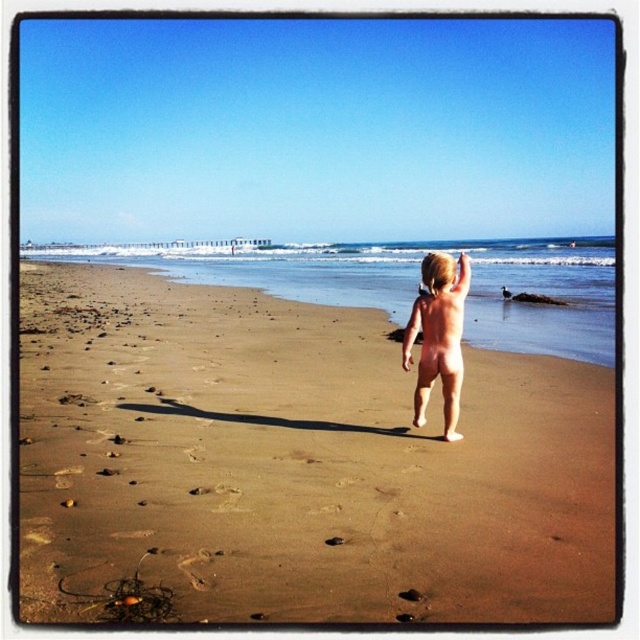
Can you confirm if brown sandy beach at center is wider than nude skin at center?

Correct, the width of brown sandy beach at center exceeds that of nude skin at center.

Describe the element at coordinates (292, 465) in the screenshot. I see `brown sandy beach at center` at that location.

I want to click on brown sandy beach at center, so click(x=292, y=465).